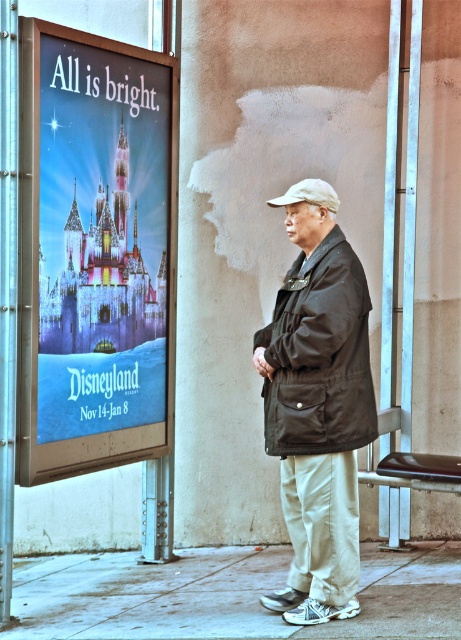
Question: Which point is farther from the camera taking this photo?

Choices:
 (A) (360, 422)
 (B) (76, 147)

Answer: (B)

Question: Which object appears closest to the camera in this image?

Choices:
 (A) gray concrete pavement at lower center
 (B) matte plastic poster at left
 (C) black matte jacket at center

Answer: (A)

Question: Does matte plastic poster at left have a lesser width compared to gray concrete pavement at lower center?

Choices:
 (A) yes
 (B) no

Answer: (A)

Question: Which of the following is the closest to the observer?

Choices:
 (A) (327, 253)
 (B) (135, 86)
 (C) (171, 609)

Answer: (A)

Question: Does gray concrete pavement at lower center appear under black matte jacket at center?

Choices:
 (A) no
 (B) yes

Answer: (B)

Question: Can you confirm if gray concrete pavement at lower center is bigger than black matte jacket at center?

Choices:
 (A) yes
 (B) no

Answer: (A)